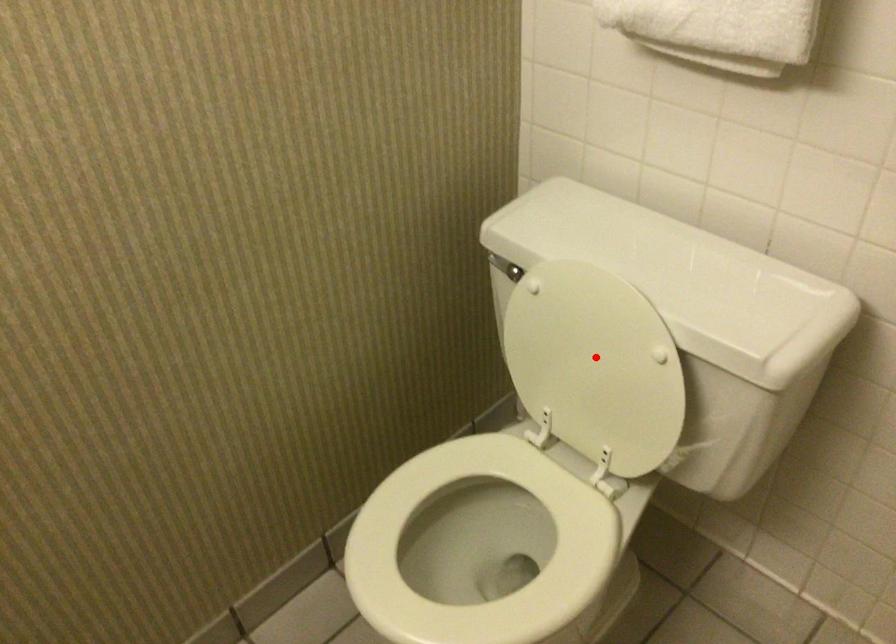
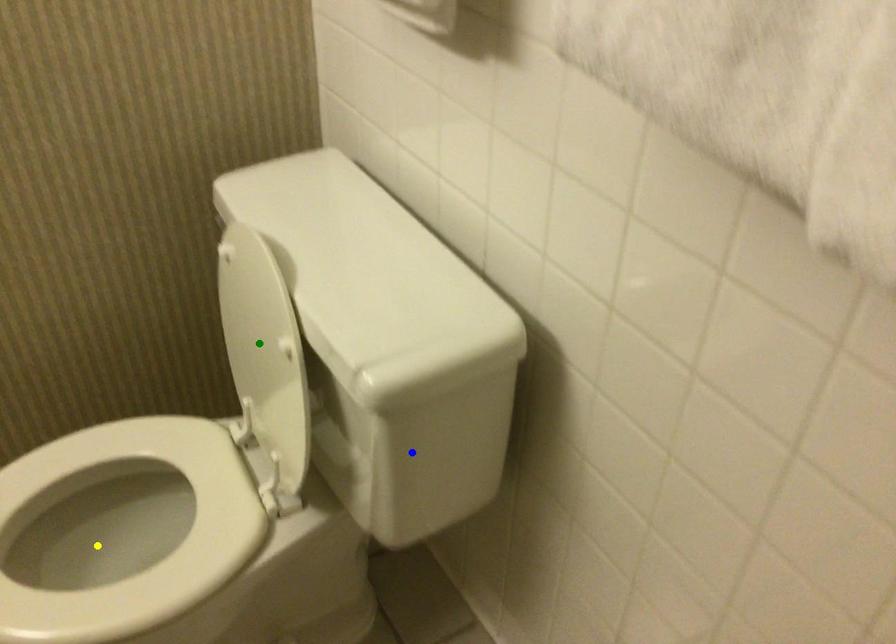
Question: I am providing you with two images of the same scene from different viewpoints. A red point is marked on the first image. You are given multiple points on the second image. Which point in image 2 represents the same 3d spot as the red point in image 1?

Choices:
 (A) blue point
 (B) yellow point
 (C) green point

Answer: (C)